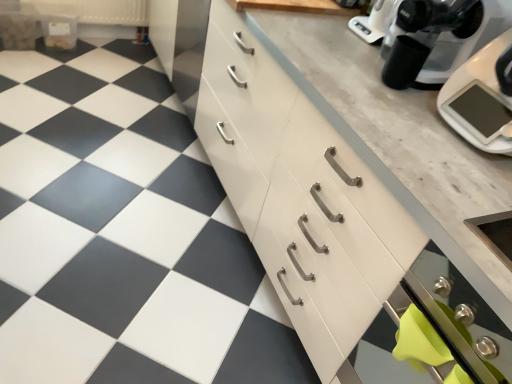
Find the location of a particular element. The height and width of the screenshot is (384, 512). vacant region in front of black plastic coffee maker at upper right is located at coordinates (400, 107).